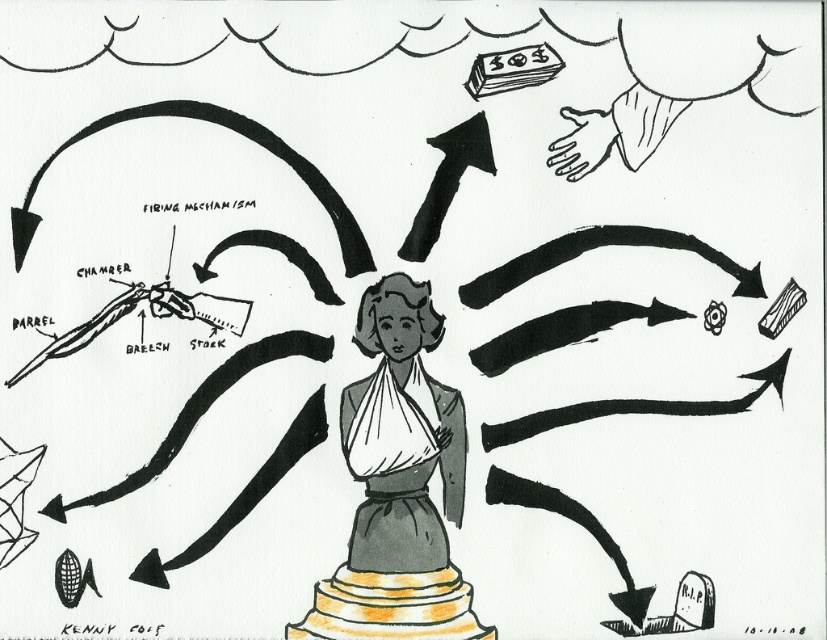
Question: Which object is farther from the camera taking this photo?

Choices:
 (A) dark gray fabric dress at center
 (B) gray fabric dress at center

Answer: (A)

Question: From the image, what is the correct spatial relationship of gray fabric dress at center in relation to dark gray fabric dress at center?

Choices:
 (A) right
 (B) left

Answer: (B)

Question: Which point is closer to the camera taking this photo?

Choices:
 (A) (383, 440)
 (B) (380, 520)

Answer: (B)

Question: Which object is farther from the camera taking this photo?

Choices:
 (A) gray fabric dress at center
 (B) dark gray fabric dress at center

Answer: (B)

Question: Is gray fabric dress at center closer to the viewer compared to dark gray fabric dress at center?

Choices:
 (A) yes
 (B) no

Answer: (A)

Question: Is gray fabric dress at center bigger than dark gray fabric dress at center?

Choices:
 (A) yes
 (B) no

Answer: (A)